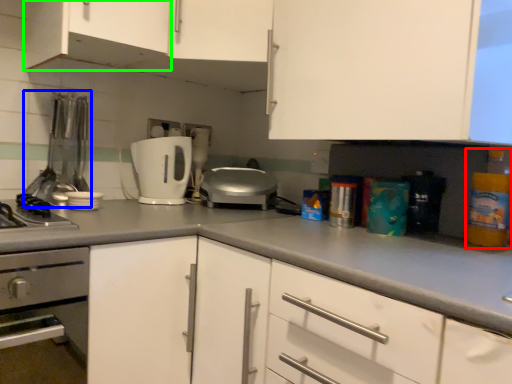
Question: Which object is positioned closest to bottle (highlighted by a red box)? Select from appliance (highlighted by a blue box) and cabinetry (highlighted by a green box).

Choices:
 (A) appliance
 (B) cabinetry

Answer: (B)